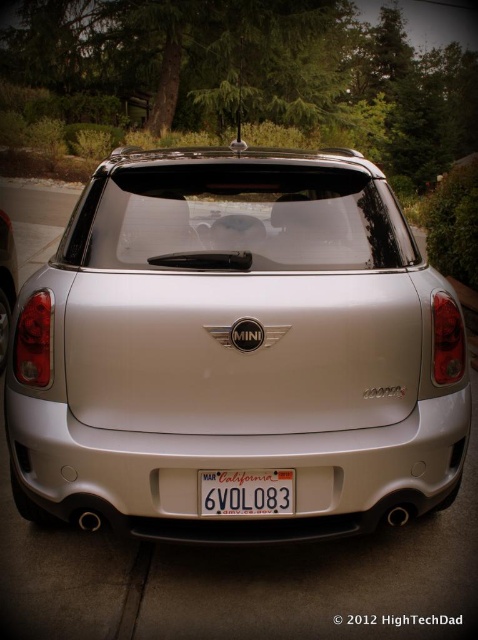
Based on the photo, you are standing at the center of a parking lot and see the satin silver car at center. If you want to walk directly towards it, which direction should you face?

Since the satin silver car at center is located at point coordinates, you should face directly towards the center of the parking lot to walk towards it.

You are a photographer trying to capture the Mini Cooper S from the rear. You want to ensure both the satin silver car at center and the white plastic license plate at center are clearly visible in your shot. Given their sizes, which object will occupy more space in the photo?

The satin silver car at center is bigger than the white plastic license plate at center, so it will occupy more space in the photo.